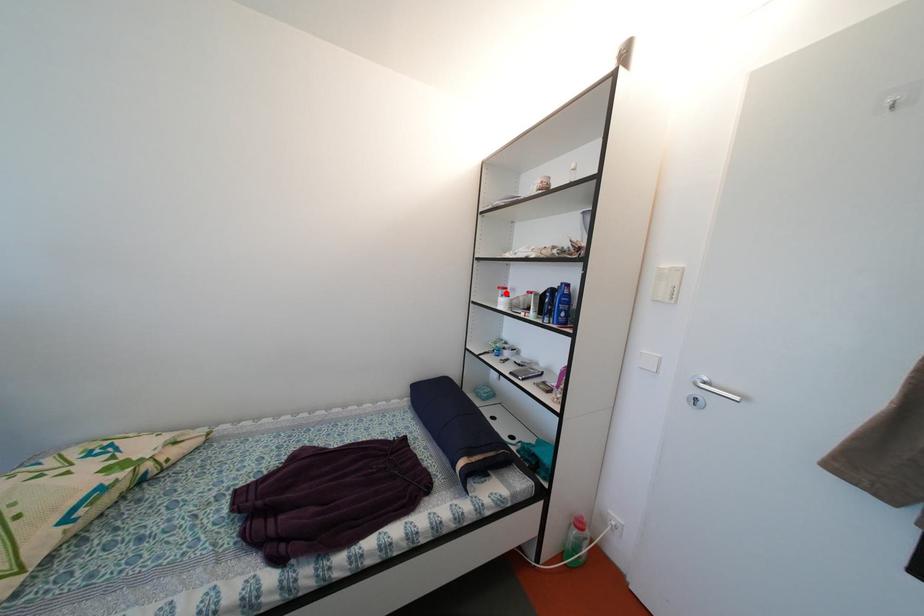
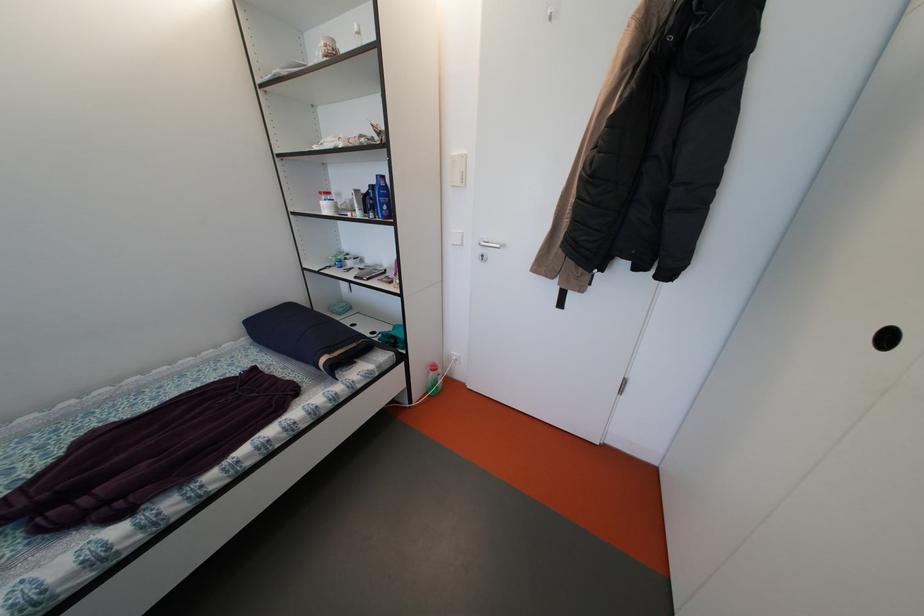
The point at the highlighted location is marked in the first image. Where is the corresponding point in the second image?

(327, 198)